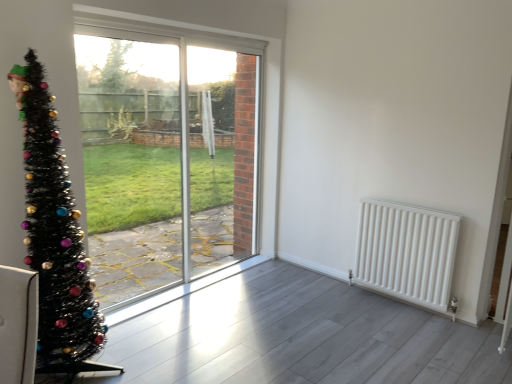
Identify the location of vacant space in front of transparent glass window at center. Image resolution: width=512 pixels, height=384 pixels. (195, 326).